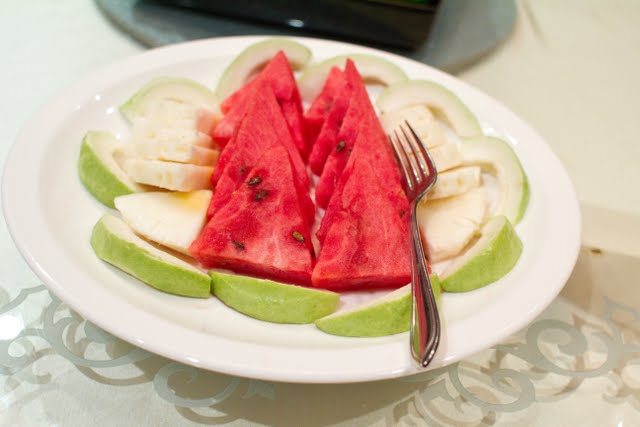
The height and width of the screenshot is (427, 640). Find the location of `wall`. wall is located at coordinates (576, 73).